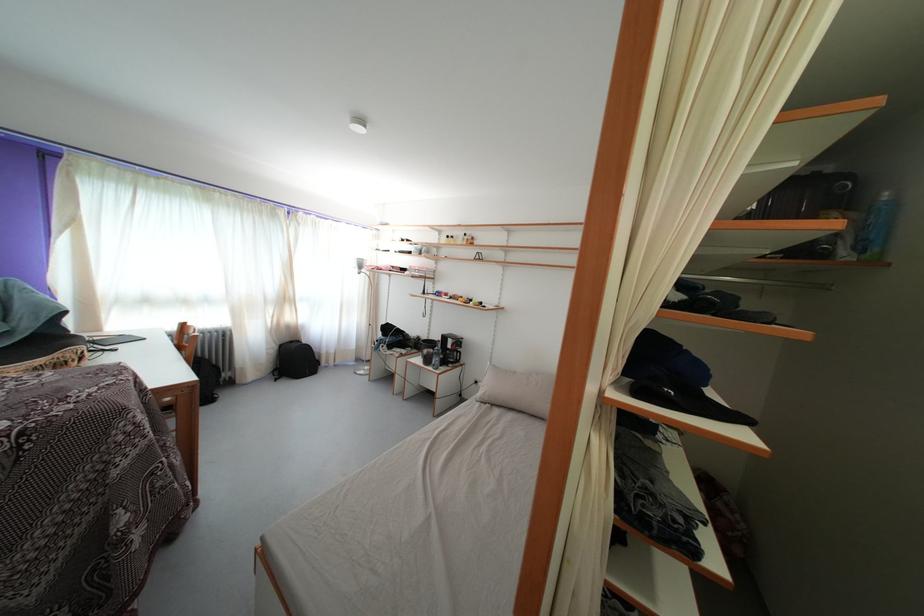
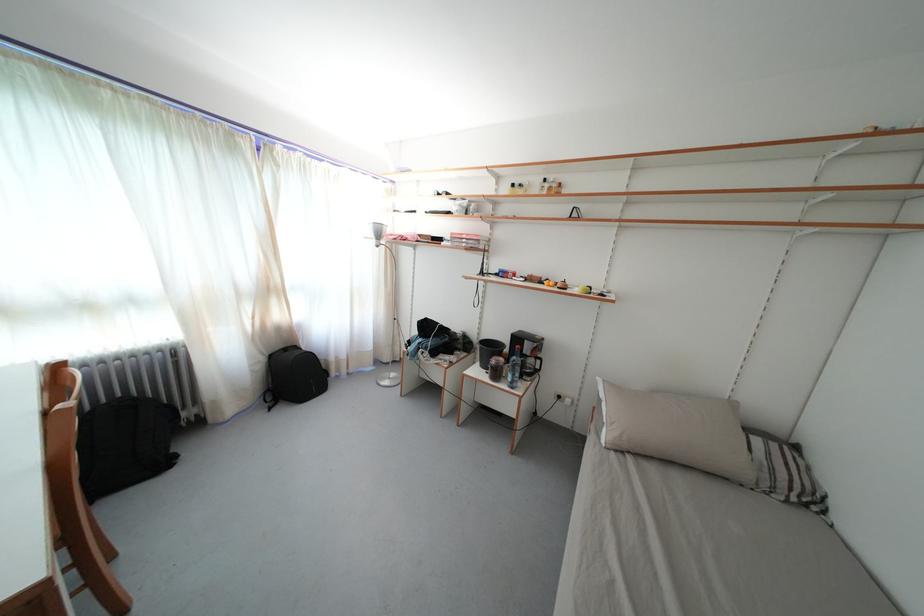
In the second image, find the point that corresponds to point (431, 357) in the first image.

(499, 367)